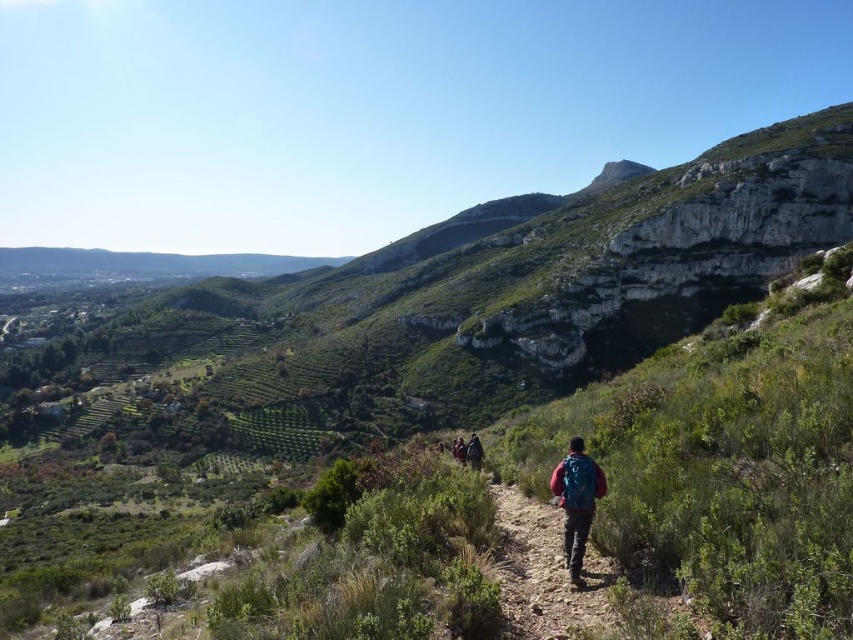
Does point (519, 632) come in front of point (579, 561)?

Yes, point (519, 632) is in front of point (579, 561).

Is point (554, 616) more distant than point (602, 483)?

No, (554, 616) is closer to viewer.

Is point (570, 584) positioned in front of point (585, 525)?

Yes, it is.

Where is `matte blue backpack at center`? matte blue backpack at center is located at coordinates 543,572.

Is teal fabric backpack at center thinner than dark blue jacket at center?

Incorrect, teal fabric backpack at center's width is not less than dark blue jacket at center's.

What do you see at coordinates (474, 452) in the screenshot? Image resolution: width=853 pixels, height=640 pixels. I see `teal fabric backpack at center` at bounding box center [474, 452].

Which is behind, point (476, 452) or point (456, 454)?

The point (456, 454) is behind.

I want to click on teal fabric backpack at center, so click(474, 452).

Does matte blue backpack at center have a greater width compared to teal fabric backpack at center?

Yes.

Between matte blue backpack at center and teal fabric backpack at center, which one appears on the left side from the viewer's perspective?

teal fabric backpack at center is more to the left.

Who is more forward, (556, 580) or (479, 445)?

Point (556, 580)

Identify the location of matte blue backpack at center. (543, 572).